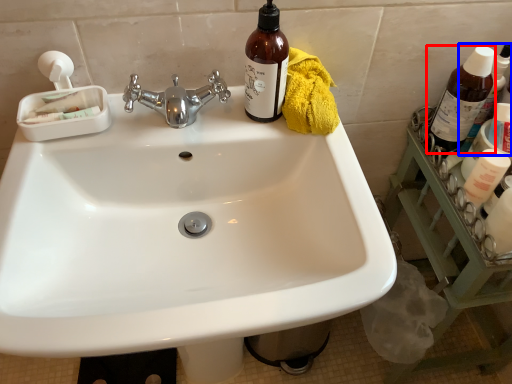
Question: Which object is closer to the camera taking this photo, bottle (highlighted by a red box) or bottle (highlighted by a blue box)?

Choices:
 (A) bottle
 (B) bottle

Answer: (A)